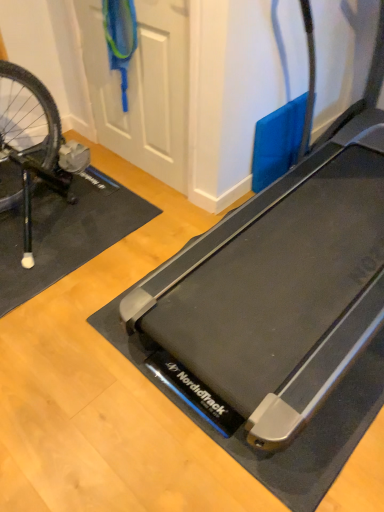
Question: From a real-world perspective, is white matte door at upper center on top of black rubber treadmill at center?

Choices:
 (A) no
 (B) yes

Answer: (A)

Question: From a real-world perspective, does white matte door at upper center sit lower than black rubber treadmill at center?

Choices:
 (A) yes
 (B) no

Answer: (A)

Question: Is black rubber treadmill at center located within white matte door at upper center?

Choices:
 (A) yes
 (B) no

Answer: (B)

Question: Considering the relative sizes of white matte door at upper center and black rubber treadmill at center in the image provided, is white matte door at upper center smaller than black rubber treadmill at center?

Choices:
 (A) yes
 (B) no

Answer: (A)

Question: Can we say white matte door at upper center lies outside black rubber treadmill at center?

Choices:
 (A) no
 (B) yes

Answer: (B)

Question: Is white matte door at upper center further to the viewer compared to black rubber treadmill at center?

Choices:
 (A) no
 (B) yes

Answer: (B)

Question: Does black rubber treadmill at center touch white matte door at upper center?

Choices:
 (A) yes
 (B) no

Answer: (B)

Question: Would you say black rubber treadmill at center is a long distance from white matte door at upper center?

Choices:
 (A) no
 (B) yes

Answer: (A)

Question: Can you confirm if black rubber treadmill at center is shorter than white matte door at upper center?

Choices:
 (A) no
 (B) yes

Answer: (A)

Question: From a real-world perspective, is black rubber treadmill at center on white matte door at upper center?

Choices:
 (A) no
 (B) yes

Answer: (B)

Question: Can you confirm if black rubber treadmill at center is smaller than white matte door at upper center?

Choices:
 (A) yes
 (B) no

Answer: (B)

Question: Is black rubber treadmill at center facing towards white matte door at upper center?

Choices:
 (A) yes
 (B) no

Answer: (B)

Question: Is black rubber yoga mat at left at the left side of white matte door at upper center?

Choices:
 (A) yes
 (B) no

Answer: (A)